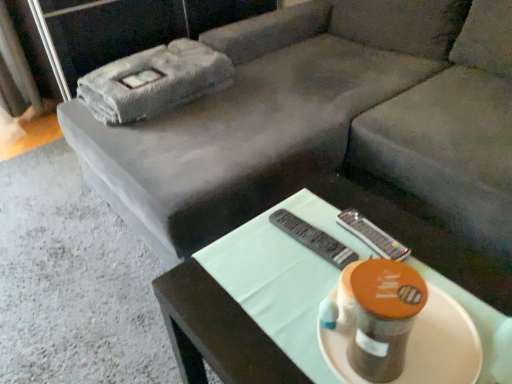
Find the location of `free point above matte black table at center (from a real-world perspective)`. free point above matte black table at center (from a real-world perspective) is located at coordinates (339, 266).